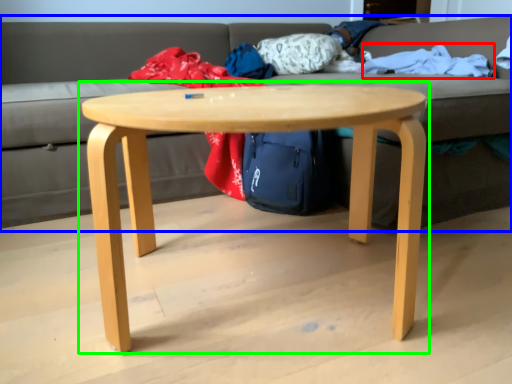
Question: Which object is the farthest from blanket (highlighted by a red box)? Choose among these: studio couch (highlighted by a blue box) or coffee table (highlighted by a green box).

Choices:
 (A) studio couch
 (B) coffee table

Answer: (A)